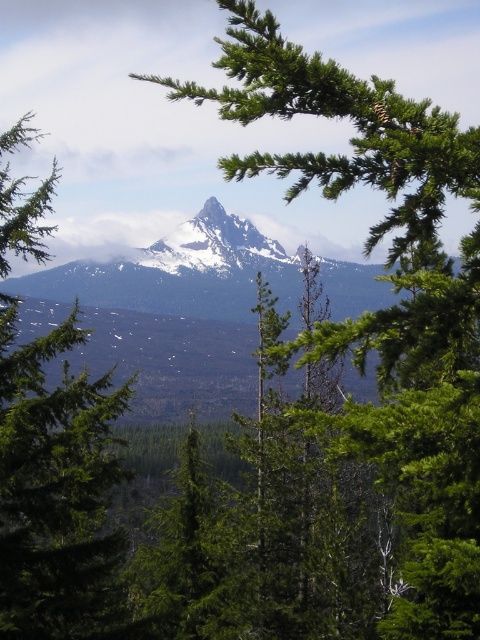
Between green leafy branch at center and snowy rock mountain at center, which one is positioned higher?

green leafy branch at center is higher up.

Is green leafy branch at center closer to camera compared to snowy rock mountain at center?

Yes, green leafy branch at center is closer to the viewer.

Does point (417, 314) lie behind point (81, 288)?

That is False.

Where is `green leafy branch at center`? green leafy branch at center is located at coordinates (387, 307).

The height and width of the screenshot is (640, 480). Describe the element at coordinates (57, 492) in the screenshot. I see `green matte tree at center` at that location.

Is green matte tree at center bigger than white snow-covered peak at center?

Yes.

You are a GUI agent. You are given a task and a screenshot of the screen. Output one action in this format:
    pyautogui.click(x=<x>, y=<y>)
    Task: Click on the green matte tree at center
    This screenshot has width=480, height=640.
    Given the screenshot: What is the action you would take?
    pyautogui.click(x=57, y=492)

Who is positioned more to the left, green matte tree at center or snowy rock mountain at center?

green matte tree at center

Between green matte tree at center and snowy rock mountain at center, which one appears on the right side from the viewer's perspective?

From the viewer's perspective, snowy rock mountain at center appears more on the right side.

Find the location of a particular element. This screenshot has width=480, height=640. green matte tree at center is located at coordinates (57, 492).

The height and width of the screenshot is (640, 480). I want to click on green matte tree at center, so (x=57, y=492).